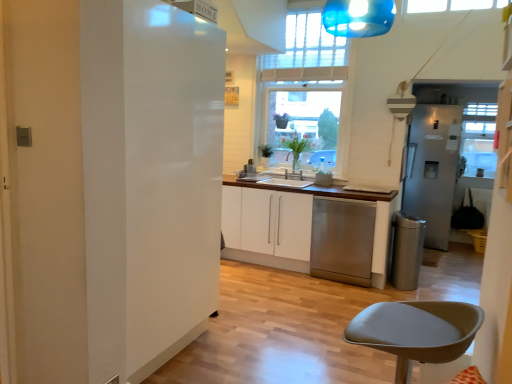
Question: From a real-world perspective, is stainless steel trash can at lower right positioned under stainless steel dishwasher at center based on gravity?

Choices:
 (A) yes
 (B) no

Answer: (A)

Question: Is stainless steel dishwasher at center at the back of stainless steel trash can at lower right?

Choices:
 (A) yes
 (B) no

Answer: (A)

Question: Is stainless steel trash can at lower right shorter than stainless steel dishwasher at center?

Choices:
 (A) yes
 (B) no

Answer: (A)

Question: Considering the relative sizes of stainless steel trash can at lower right and stainless steel dishwasher at center in the image provided, is stainless steel trash can at lower right smaller than stainless steel dishwasher at center?

Choices:
 (A) no
 (B) yes

Answer: (B)

Question: Does stainless steel trash can at lower right have a greater width compared to stainless steel dishwasher at center?

Choices:
 (A) no
 (B) yes

Answer: (A)

Question: Based on their sizes in the image, would you say satin silver refrigerator at right, the 2th fridge in the front-to-back sequence, is bigger or smaller than white glossy refrigerator at left, the second fridge when ordered from right to left?

Choices:
 (A) small
 (B) big

Answer: (A)

Question: Is satin silver refrigerator at right, the first fridge from the right, wider or thinner than white glossy refrigerator at left, placed as the 1th fridge when sorted from left to right?

Choices:
 (A) wide
 (B) thin

Answer: (A)

Question: Choose the correct answer: Is satin silver refrigerator at right, which appears as the 1th fridge when viewed from the back, inside white glossy refrigerator at left, which is counted as the 2th fridge, starting from the back, or outside it?

Choices:
 (A) inside
 (B) outside

Answer: (B)

Question: Is satin silver refrigerator at right, arranged as the second fridge when viewed from the left, to the left or to the right of white glossy refrigerator at left, arranged as the 1th fridge when viewed from the front, in the image?

Choices:
 (A) right
 (B) left

Answer: (A)

Question: Is white glossy refrigerator at left, arranged as the 1th fridge when viewed from the front, inside the boundaries of clear glass window at center, or outside?

Choices:
 (A) outside
 (B) inside

Answer: (A)

Question: Considering their positions, is white glossy refrigerator at left, which is counted as the 2th fridge, starting from the back, located in front of or behind clear glass window at center?

Choices:
 (A) front
 (B) behind

Answer: (A)

Question: Is point (222, 46) positioned closer to the camera than point (272, 140)?

Choices:
 (A) farther
 (B) closer

Answer: (B)

Question: Based on their sizes in the image, would you say white glossy refrigerator at left, arranged as the 1th fridge when viewed from the front, is bigger or smaller than clear glass window at center?

Choices:
 (A) small
 (B) big

Answer: (B)

Question: Considering the positions of satin silver refrigerator at right, which appears as the 1th fridge when viewed from the back, and white glossy cabinet at center in the image, is satin silver refrigerator at right, which appears as the 1th fridge when viewed from the back, wider or thinner than white glossy cabinet at center?

Choices:
 (A) wide
 (B) thin

Answer: (A)

Question: Considering the positions of satin silver refrigerator at right, the first fridge from the right, and white glossy cabinet at center in the image, is satin silver refrigerator at right, the first fridge from the right, taller or shorter than white glossy cabinet at center?

Choices:
 (A) short
 (B) tall

Answer: (B)